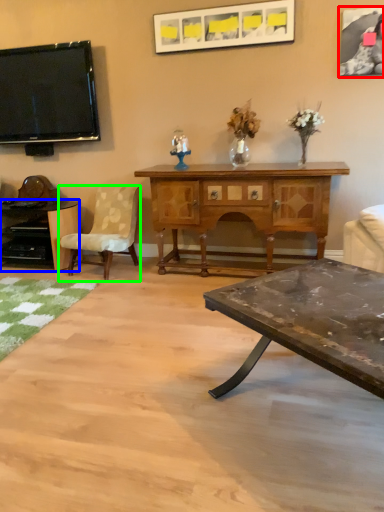
Question: Considering the real-world distances, which object is farthest from picture frame (highlighted by a red box)? desk (highlighted by a blue box) or chair (highlighted by a green box)?

Choices:
 (A) desk
 (B) chair

Answer: (A)